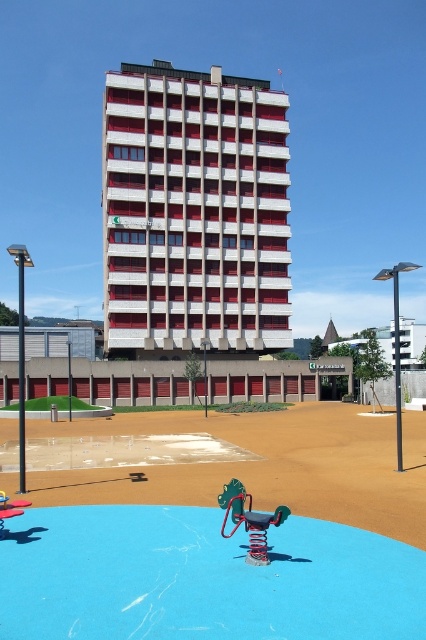
Is white concrete building at center closer to the viewer compared to metallic blue swing at center?

No, white concrete building at center is behind metallic blue swing at center.

Who is higher up, white concrete building at center or metallic blue swing at center?

white concrete building at center is above.

Which is behind, point (187, 260) or point (0, 512)?

Point (187, 260)

Where is `white concrete building at center`? This screenshot has width=426, height=640. white concrete building at center is located at coordinates (193, 212).

Which of these two, white concrete building at center or metallic spring at center, stands shorter?

With less height is metallic spring at center.

Is white concrete building at center below metallic spring at center?

No.

This screenshot has width=426, height=640. Describe the element at coordinates (193, 212) in the screenshot. I see `white concrete building at center` at that location.

What are the coordinates of `white concrete building at center` in the screenshot? It's located at (193, 212).

Can you confirm if metallic spring at center is smaller than metallic blue swing at center?

No, metallic spring at center is not smaller than metallic blue swing at center.

Is point (253, 544) positioned behind point (6, 502)?

No, it is in front of (6, 502).

Where is `metallic spring at center`? The image size is (426, 640). metallic spring at center is located at coordinates (250, 520).